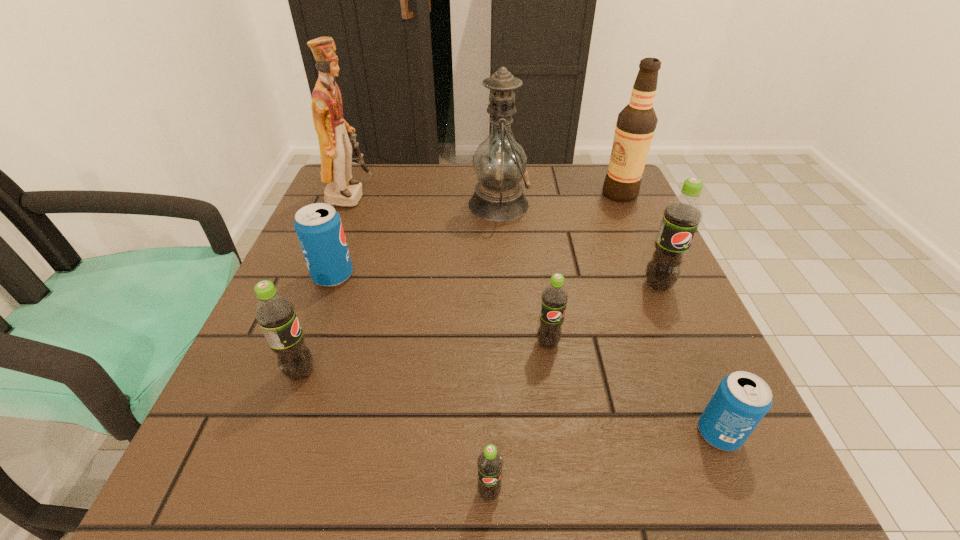
The width and height of the screenshot is (960, 540). In order to click on free space between the left blue soda can and the tallest soda in this screenshot , I will do `click(495, 280)`.

This screenshot has height=540, width=960. What are the coordinates of `free space between the left blue soda can and the gray oil lamp` in the screenshot? It's located at (416, 240).

At what (x,y) coordinates should I click in order to perform the action: click on vacant space that's between the second nearest green soda and the bigger blue soda can. Please return your answer as a coordinate pair (x, y). This screenshot has height=540, width=960. Looking at the image, I should click on 317,324.

Where is `vacant area between the left blue soda can and the second biggest green soda`? The height and width of the screenshot is (540, 960). vacant area between the left blue soda can and the second biggest green soda is located at coordinates (317, 324).

I want to click on vacant space in between the nearer blue soda can and the alcohol, so click(669, 314).

Find the location of a particular element. This screenshot has height=540, width=960. vacant space in between the smallest green soda and the rightmost green soda is located at coordinates (573, 389).

Locate an element on the screen. This screenshot has width=960, height=540. unoccupied area between the nearest soda and the fourth farthest soda is located at coordinates (395, 433).

At what (x,y) coordinates should I click in order to perform the action: click on vacant area that lies between the oil lamp and the red nutcracker. Please return your answer as a coordinate pair (x, y). Looking at the image, I should click on (424, 200).

The image size is (960, 540). Find the location of `free area in between the fourth nearest soda and the third soda from left to right`. free area in between the fourth nearest soda and the third soda from left to right is located at coordinates (518, 418).

Image resolution: width=960 pixels, height=540 pixels. What are the coordinates of `vacant region between the biggest green soda and the alcohol` in the screenshot? It's located at (638, 239).